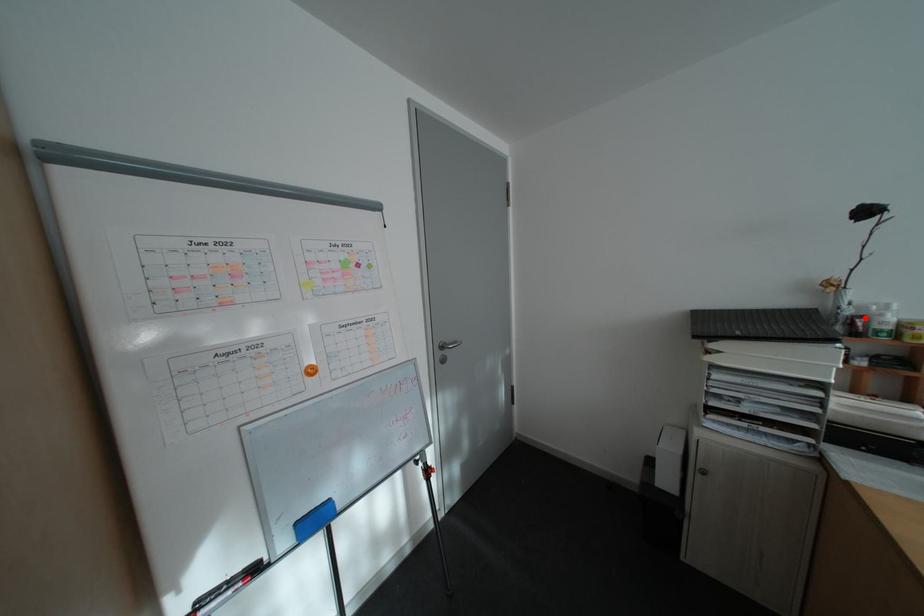
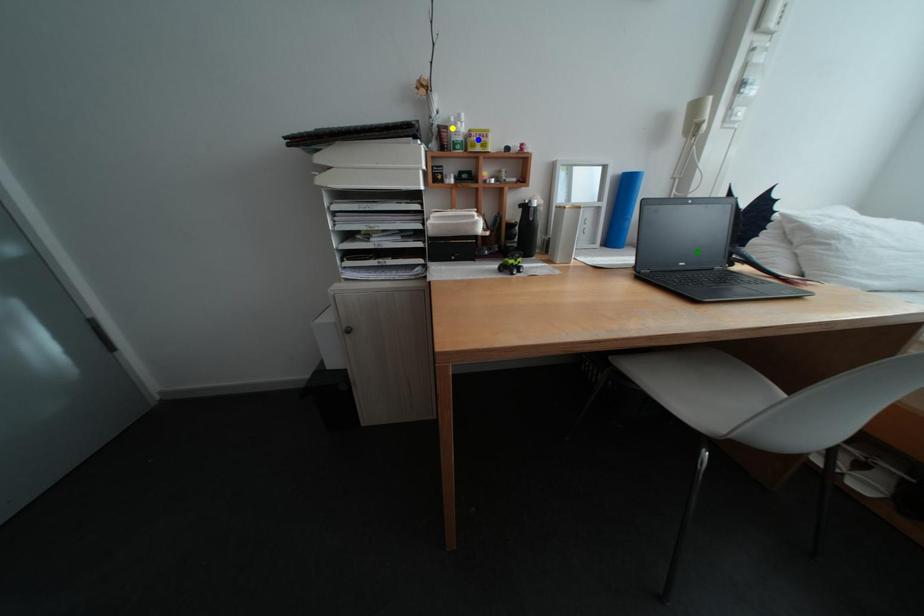
Question: I am providing you with two images of the same scene from different viewpoints. A red point is marked on the first image. You are given multiple points on the second image. Which point in image 2 represents the same 3d spot as the red point in image 1?

Choices:
 (A) green point
 (B) blue point
 (C) yellow point

Answer: (C)